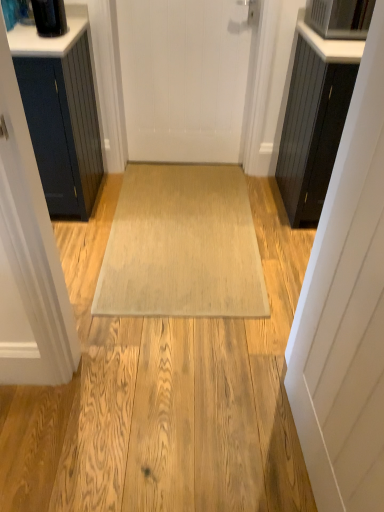
Question: From the image's perspective, is beige woven mat at center above or below black wood cabinet at right?

Choices:
 (A) below
 (B) above

Answer: (A)

Question: Is beige woven mat at center bigger or smaller than black wood cabinet at right?

Choices:
 (A) big
 (B) small

Answer: (B)

Question: Which object is the closest to the black glossy container at upper left?

Choices:
 (A) white matte door at center, which is counted as the first door, starting from the left
 (B) black wood cabinet at right
 (C) satin silver microwave at upper right
 (D) beige woven mat at center
 (E) white matte door at right, which appears as the second door when viewed from the back

Answer: (A)

Question: Which object is the closest to the satin silver microwave at upper right?

Choices:
 (A) black wood cabinet at right
 (B) black glossy container at upper left
 (C) beige woven mat at center
 (D) white matte door at center, which is counted as the first door, starting from the left
 (E) white matte door at right, the first door from the front

Answer: (A)